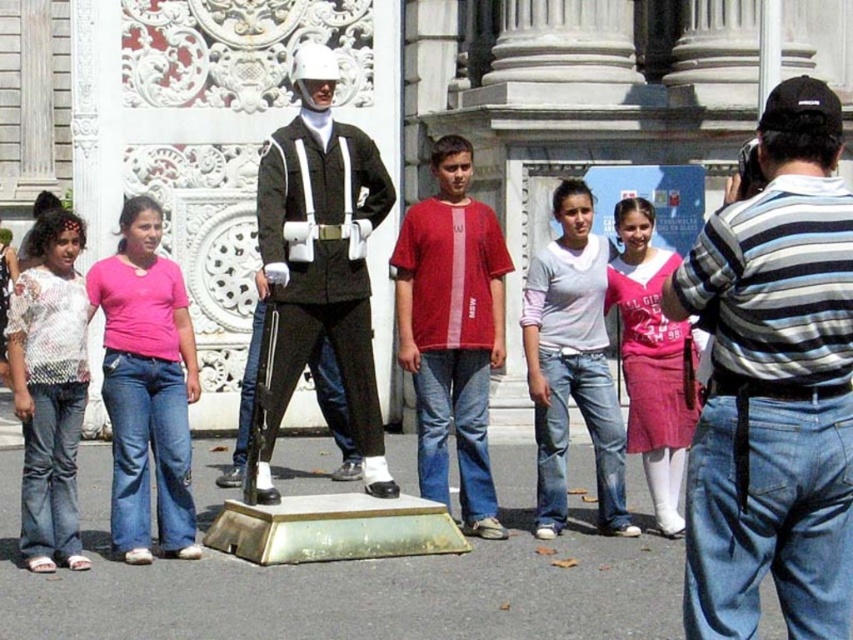
Question: Where is red matte t-shirt at center located in relation to pink fabric shirt at left in the image?

Choices:
 (A) above
 (B) below

Answer: (A)

Question: Where is dark green fabric uniform at center located in relation to red matte t-shirt at center in the image?

Choices:
 (A) above
 (B) below

Answer: (B)

Question: Which object is positioned farthest from the striped cotton shirt at right?

Choices:
 (A) red matte t-shirt at center
 (B) dark green fabric uniform at center
 (C) white lace shirt at left

Answer: (C)

Question: Which of the following is the farthest from the observer?

Choices:
 (A) dark green fabric uniform at center
 (B) pink fabric shirt at left
 (C) striped cotton shirt at right

Answer: (A)

Question: Does dark green fabric uniform at center appear on the right side of white lace shirt at left?

Choices:
 (A) yes
 (B) no

Answer: (A)

Question: Which point is closer to the camera?

Choices:
 (A) (538, 432)
 (B) (39, 280)
 (C) (329, 298)
 (D) (827, 486)

Answer: (D)